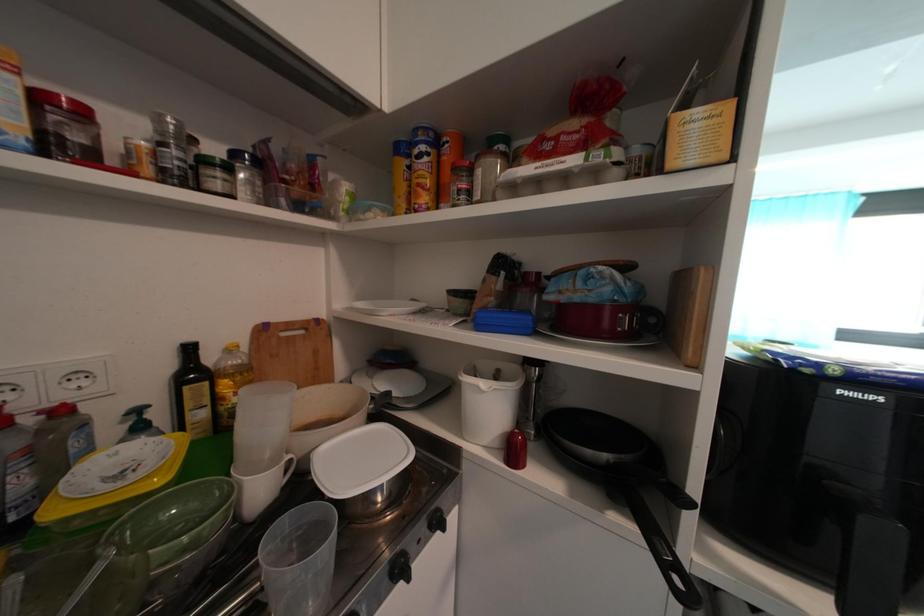
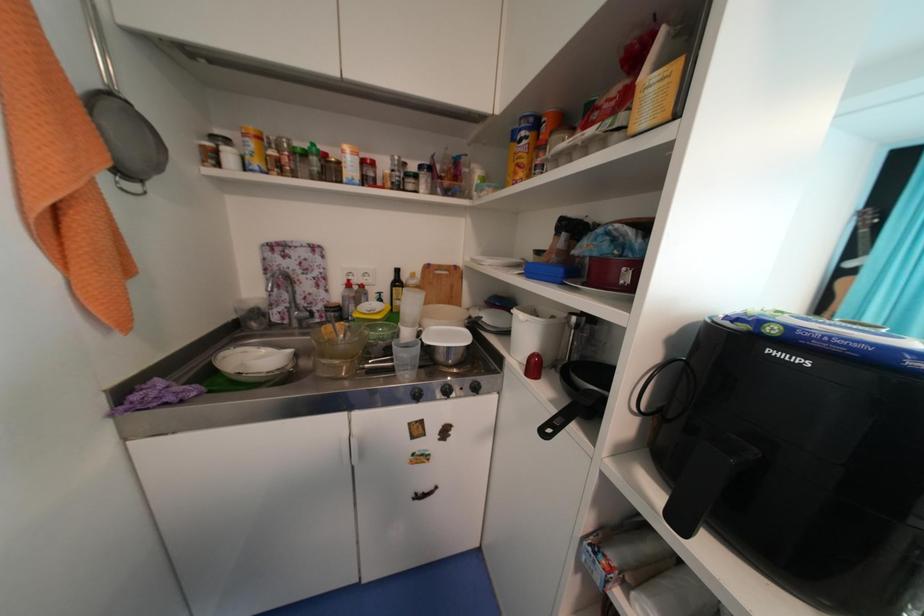
Question: The first image is from the beginning of the video and the second image is from the end. How did the camera likely rotate when shooting the video?

Choices:
 (A) Left
 (B) Right
 (C) Up
 (D) Down

Answer: (A)